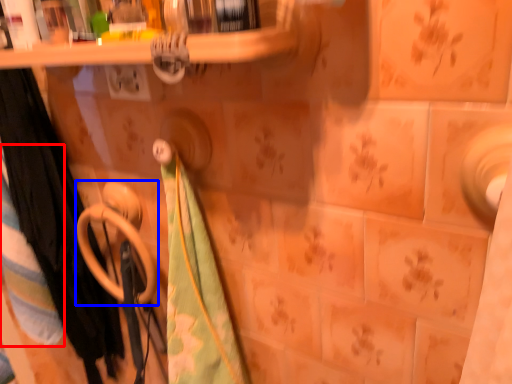
Question: Among these objects, which one is nearest to the camera, beach towel (highlighted by a red box) or towel rack (highlighted by a blue box)?

Choices:
 (A) beach towel
 (B) towel rack

Answer: (B)